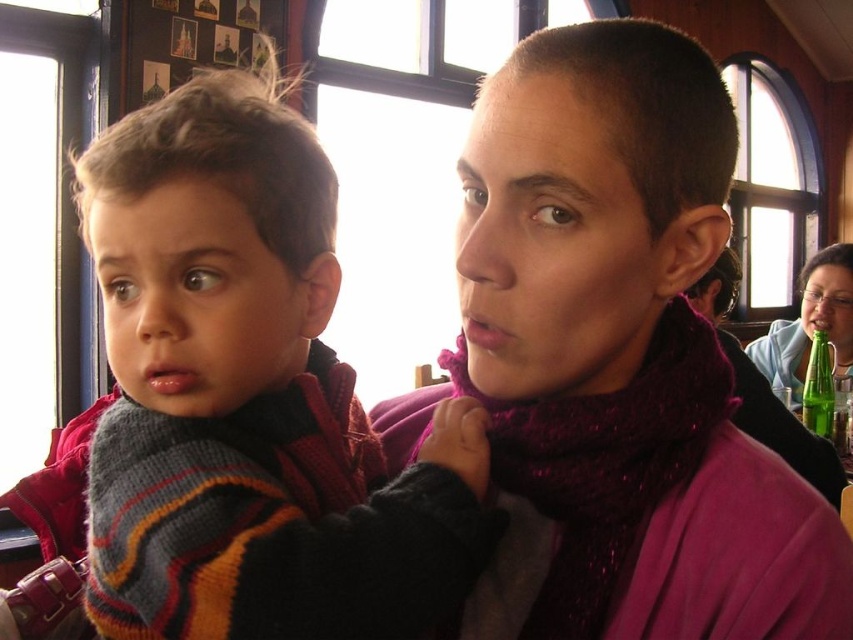
You are standing in the scene and want to place a small sticker exactly at the point marked as point (590, 404). If you hold the sticker at eye level, will you need to move your hand forward or backward to reach the point?

The point (590, 404) is 50.24 centimeters from the viewer. Since the sticker is held at eye level, you would need to move your hand forward 50.24 centimeters to reach the point.